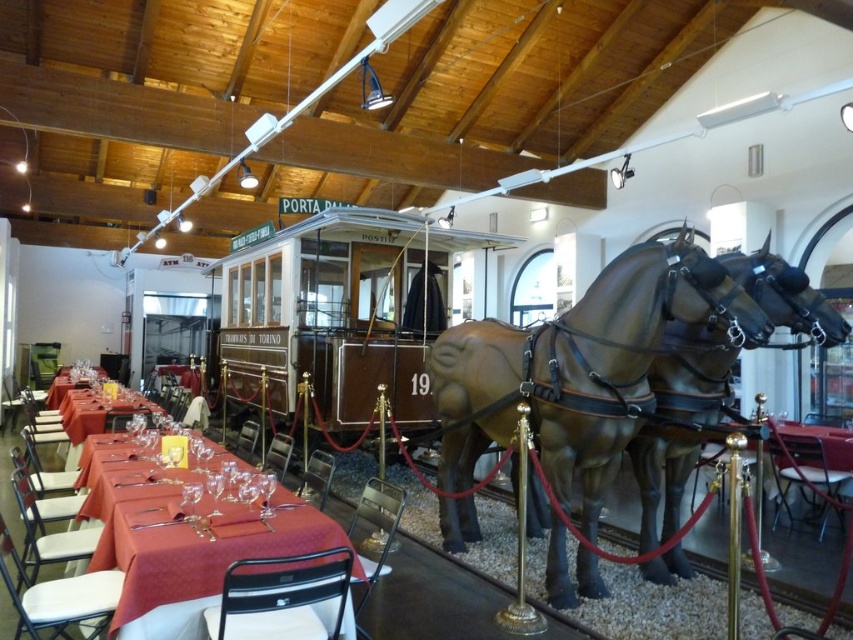
Does brown polished wood train car at center appear over matte red tablecloth at left?

Correct, brown polished wood train car at center is located above matte red tablecloth at left.

Who is more forward, (262,248) or (50,388)?

Point (262,248)

This screenshot has height=640, width=853. I want to click on brown polished wood train car at center, so click(335, 310).

Does point (332, 253) lie behind point (107, 413)?

Yes, point (332, 253) is farther from viewer.

Which is behind, point (334, 209) or point (93, 432)?

The point (93, 432) is more distant.

What are the coordinates of `brown polished wood train car at center` in the screenshot? It's located at (335, 310).

Who is lower down, matte red tablecloth at center or matte red tablecloth at left?

matte red tablecloth at left is below.

Does point (271, 516) lie behind point (62, 374)?

No.

Between point (271, 547) and point (93, 365), which one is positioned in front?

Point (271, 547) is in front.

This screenshot has width=853, height=640. Find the location of `matte red tablecloth at center`. matte red tablecloth at center is located at coordinates 177,541.